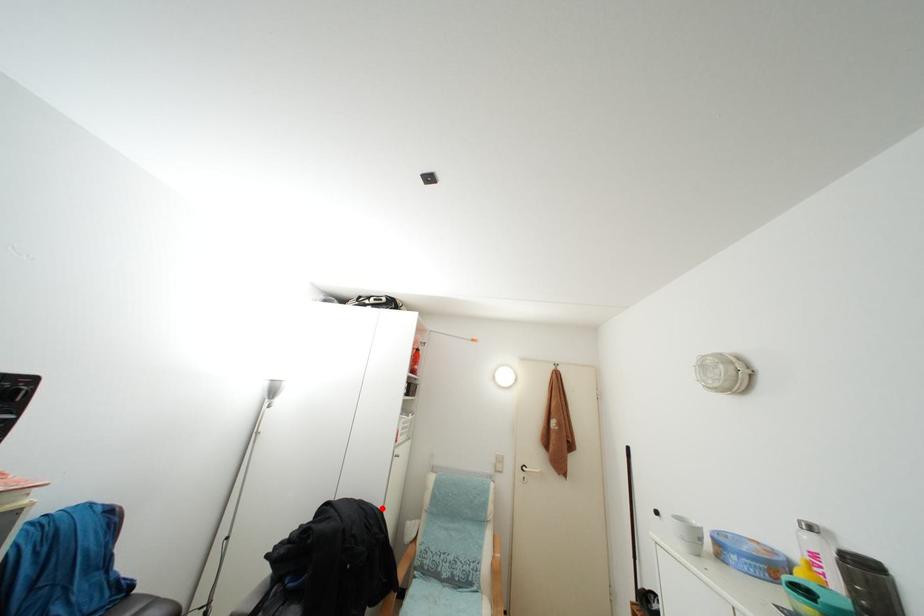
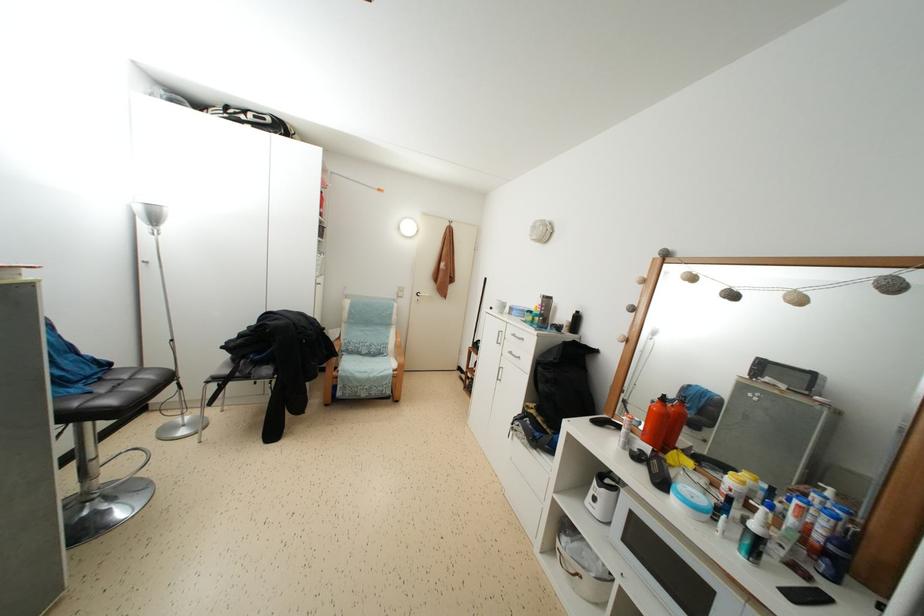
Question: A red point is marked in image1. In image2, is the corresponding 3D point closer to the camera or farther? Reply with the corresponding letter.

Choices:
 (A) The corresponding 3D point is closer.
 (B) The corresponding 3D point is farther.

Answer: (A)